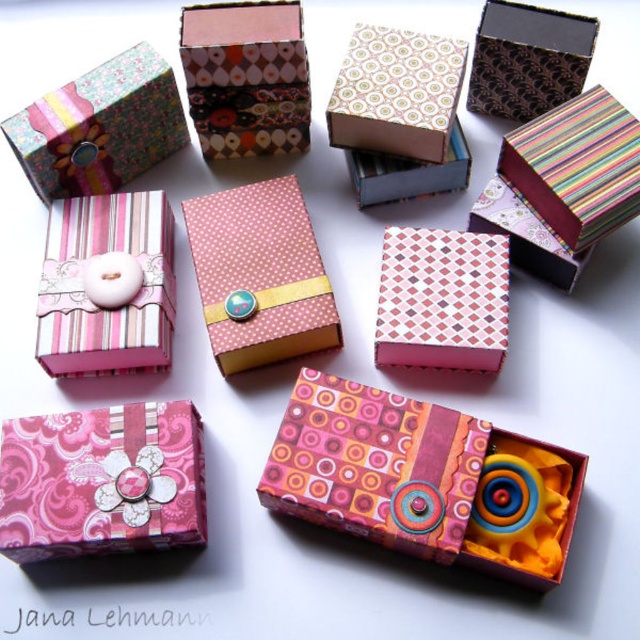
Question: Can you confirm if patterned paper gift box at center is positioned to the left of pink fabric gift box at lower left?

Choices:
 (A) no
 (B) yes

Answer: (A)

Question: Can you confirm if patterned paper gift box at center is smaller than multicolored striped gift box at upper right?

Choices:
 (A) no
 (B) yes

Answer: (A)

Question: Which object is the closest to the patterned paper gift box at upper center?

Choices:
 (A) pink fabric gift box at lower left
 (B) matte brown gift box at upper right
 (C) pink dotted paper gift box at center

Answer: (C)

Question: Which is nearer to the pink paper gift box at center?

Choices:
 (A) pink paper box at center
 (B) matte pink paper box at center

Answer: (A)

Question: Which object appears farthest from the camera in this image?

Choices:
 (A) pink paper box at center
 (B) matte pink paper box at center
 (C) multicolored striped gift box at upper right

Answer: (B)

Question: Observing the image, what is the correct spatial positioning of pink paper gift box at center in reference to matte pink paper box at center?

Choices:
 (A) right
 (B) left

Answer: (A)